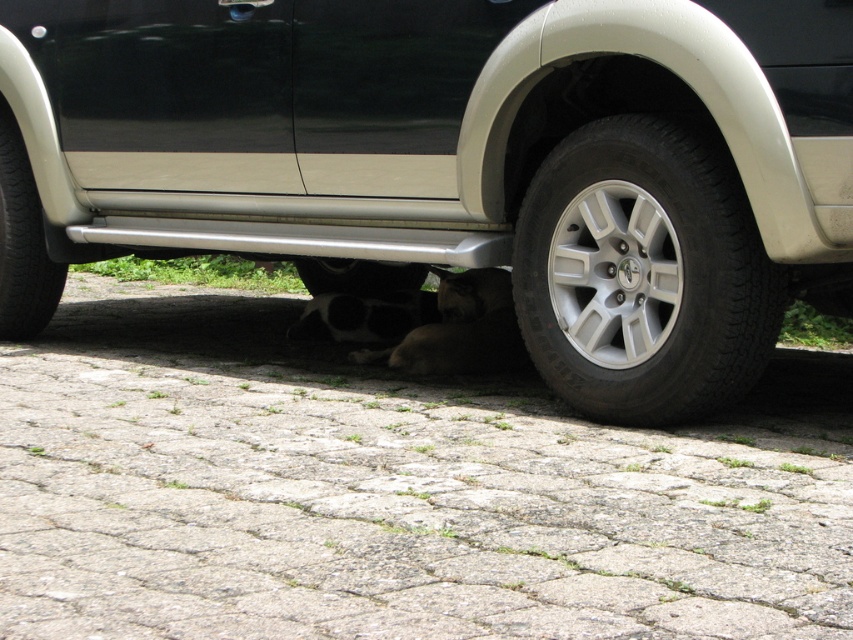
You are a delivery person trying to park your delivery van next to the black matte car at lower center. The black rubber tire at lower center belongs to the car. If your van is 2 meters wide, can you safely park your van next to the car without overlapping the tire?

The black matte car at lower center is wider than the black rubber tire at lower center. However, the exact width of the car and the tire are not provided. To determine if the van can park safely, you need to know the specific widths of both the car and the tire. Without this information, it is impossible to confirm if there will be enough space between them to avoid overlapping.

Looking at this image, you are a mechanic inspecting a vehicle. You notice the black matte car at lower center and the black rubber tire at lower left. Which object is directly above the other?

The black matte car at lower center is positioned over the black rubber tire at lower left.

You are a mechanic inspecting the vehicle from below. You notice the silver metallic wheel at lower right and the black rubber tire at lower center. Which object has a larger size?

The silver metallic wheel at lower right is bigger than the black rubber tire at lower center.